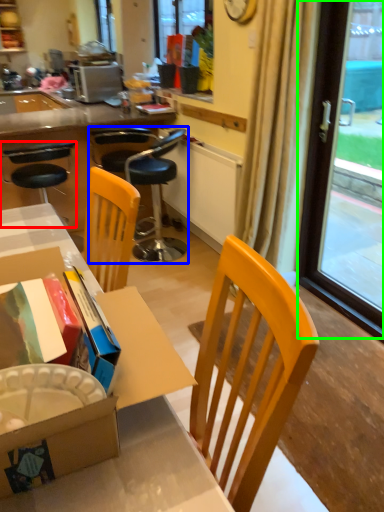
Question: Which object is the closest to the chair (highlighted by a red box)? Choose among these: chair (highlighted by a blue box) or window screen (highlighted by a green box).

Choices:
 (A) chair
 (B) window screen

Answer: (A)